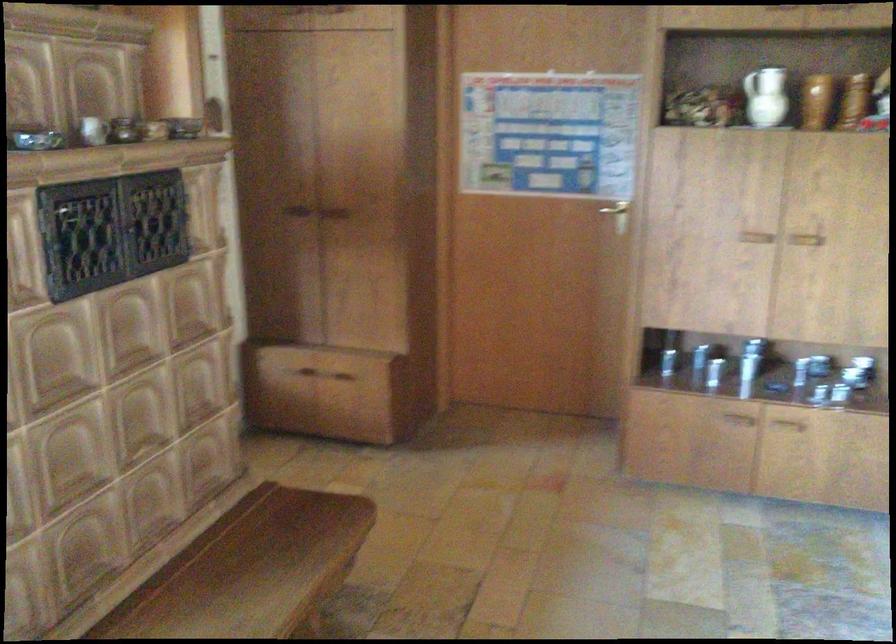
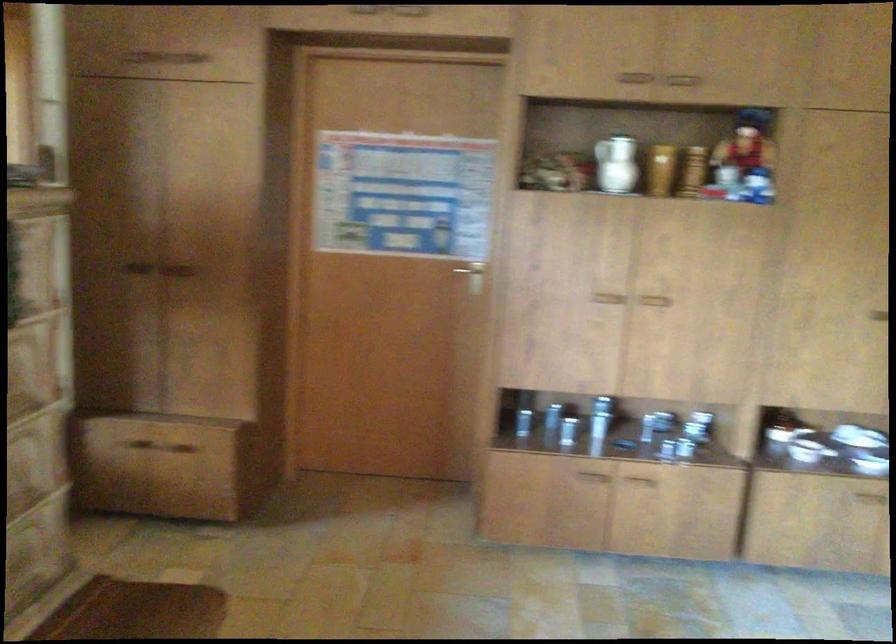
The point at (780, 450) is marked in the first image. Where is the corresponding point in the second image?

(636, 509)